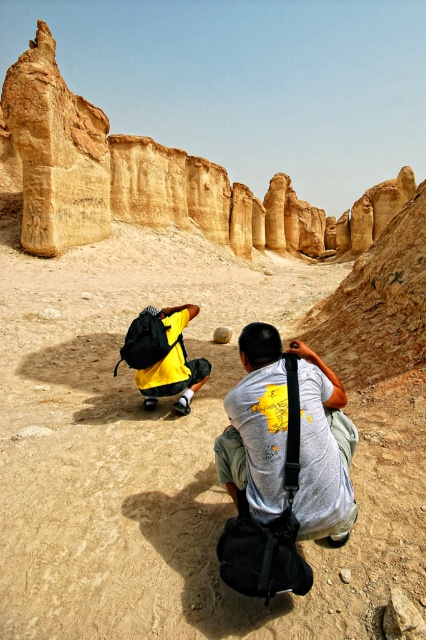
Can you confirm if sandstone rock formation at upper left is wider than smooth beige rock at center?

Yes.

Is point (224, 228) farther from camera compared to point (232, 333)?

Yes, it is.

Which is behind, point (34, 97) or point (226, 340)?

The point (34, 97) is behind.

Identify the location of sandstone rock formation at upper left. (149, 179).

Is sandstone rock formation at upper left closer to camera compared to yellow matte backpack at center?

No, it is behind yellow matte backpack at center.

Which is behind, point (224, 225) or point (157, 349)?

Positioned behind is point (224, 225).

Which is in front, point (101, 214) or point (181, 371)?

Point (181, 371) is in front.

The image size is (426, 640). In order to click on sandstone rock formation at upper left in this screenshot , I will do `click(149, 179)`.

Which of these two, gray matte t-shirt at center or yellow matte backpack at center, stands taller?

With more height is gray matte t-shirt at center.

In the scene shown: Can you confirm if gray matte t-shirt at center is positioned to the right of yellow matte backpack at center?

Yes, gray matte t-shirt at center is to the right of yellow matte backpack at center.

I want to click on gray matte t-shirt at center, so click(256, 424).

Identify the location of gray matte t-shirt at center. This screenshot has width=426, height=640. (256, 424).